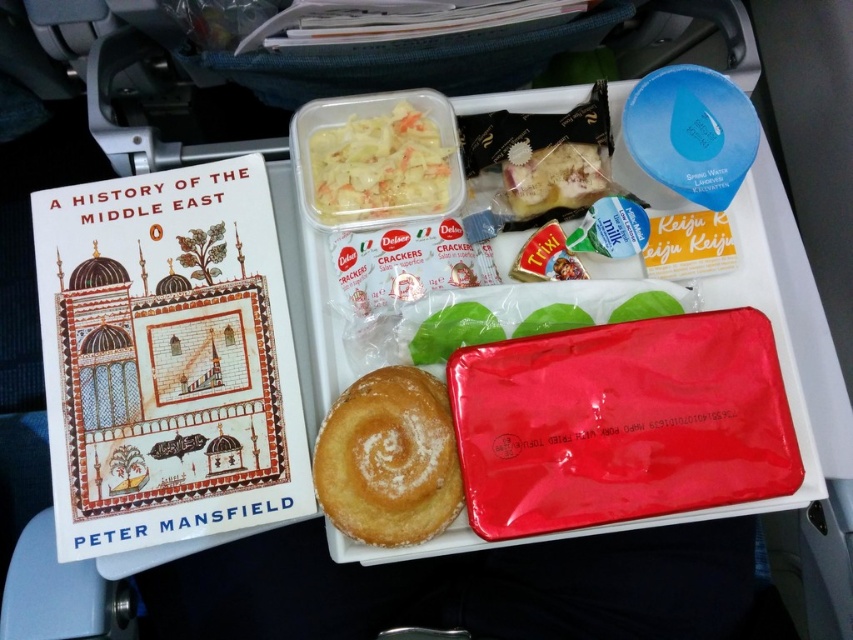
Between matte plastic tray at center and white creamy salad at upper center, which one is positioned lower?

matte plastic tray at center

Can you confirm if matte plastic tray at center is positioned to the right of white creamy salad at upper center?

Indeed, matte plastic tray at center is positioned on the right side of white creamy salad at upper center.

Who is more distant from viewer, [316,444] or [363,209]?

Positioned behind is point [363,209].

Where is `matte plastic tray at center`? The height and width of the screenshot is (640, 853). matte plastic tray at center is located at coordinates (671, 513).

Is sugared golden pastry at center bigger than yellow cheese at center?

Yes, sugared golden pastry at center is bigger than yellow cheese at center.

Who is higher up, sugared golden pastry at center or yellow cheese at center?

Positioned higher is yellow cheese at center.

You are a GUI agent. You are given a task and a screenshot of the screen. Output one action in this format:
    pyautogui.click(x=<x>, y=<y>)
    Task: Click on the sugared golden pastry at center
    Image resolution: width=853 pixels, height=640 pixels.
    Given the screenshot: What is the action you would take?
    (x=389, y=458)

Is the position of matte plastic tray at center more distant than that of sugared golden pastry at center?

No.

Identify the location of matte plastic tray at center. This screenshot has height=640, width=853. (671, 513).

Is point (309, 269) positioned before point (378, 520)?

That is False.

Identify the location of matte plastic tray at center. (671, 513).